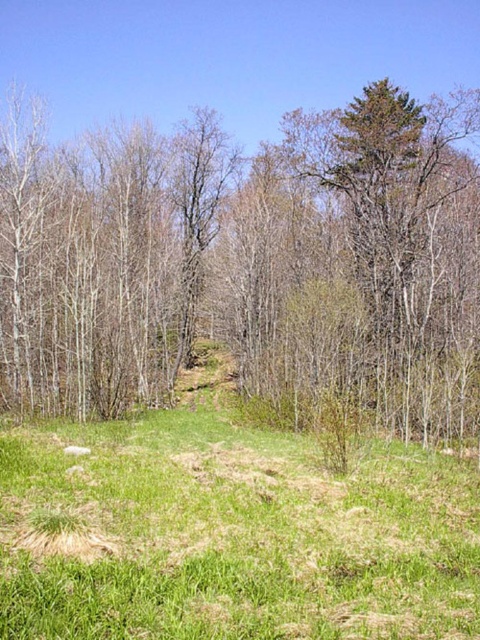
Does brown bark tree at center appear under green grass at lower center?

No.

Does brown bark tree at center have a larger size compared to green grass at lower center?

Indeed, brown bark tree at center has a larger size compared to green grass at lower center.

Does point (474, 204) come behind point (456, 536)?

Yes, point (474, 204) is farther from viewer.

Where is `brown bark tree at center`? brown bark tree at center is located at coordinates (249, 264).